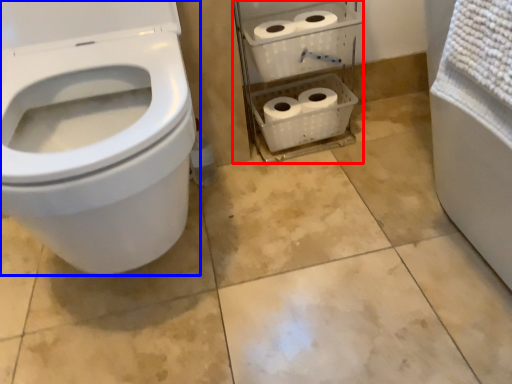
Question: Which point is further to the camera, shelf (highlighted by a red box) or toilet (highlighted by a blue box)?

Choices:
 (A) shelf
 (B) toilet

Answer: (A)